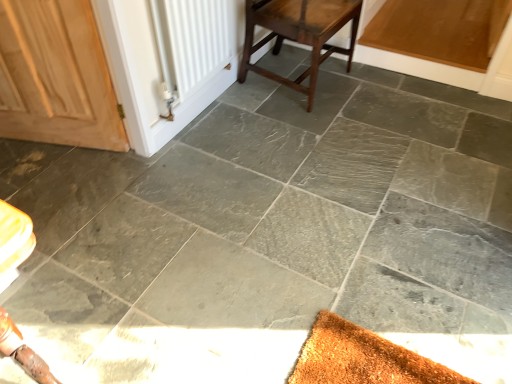
Question: Is white matte radiator at upper left completely or partially outside of dark brown wood stool at center?

Choices:
 (A) no
 (B) yes

Answer: (B)

Question: Does white matte radiator at upper left have a greater width compared to dark brown wood stool at center?

Choices:
 (A) no
 (B) yes

Answer: (A)

Question: Is white matte radiator at upper left smaller than dark brown wood stool at center?

Choices:
 (A) yes
 (B) no

Answer: (A)

Question: From the image's perspective, is white matte radiator at upper left beneath dark brown wood stool at center?

Choices:
 (A) no
 (B) yes

Answer: (B)

Question: Is white matte radiator at upper left to the right of dark brown wood stool at center from the viewer's perspective?

Choices:
 (A) yes
 (B) no

Answer: (B)

Question: Could you tell me if white matte radiator at upper left is facing dark brown wood stool at center?

Choices:
 (A) yes
 (B) no

Answer: (B)

Question: Is wooden door at left positioned before white matte radiator at upper left?

Choices:
 (A) no
 (B) yes

Answer: (B)

Question: Can you confirm if wooden door at left is bigger than white matte radiator at upper left?

Choices:
 (A) yes
 (B) no

Answer: (A)

Question: Does wooden door at left appear on the right side of white matte radiator at upper left?

Choices:
 (A) no
 (B) yes

Answer: (A)

Question: From the image's perspective, would you say wooden door at left is shown under white matte radiator at upper left?

Choices:
 (A) yes
 (B) no

Answer: (A)

Question: From the image's perspective, is wooden door at left over white matte radiator at upper left?

Choices:
 (A) no
 (B) yes

Answer: (A)

Question: Is white matte radiator at upper left a part of wooden door at left?

Choices:
 (A) no
 (B) yes

Answer: (A)

Question: Is dark brown wood stool at center facing towards wooden door at left?

Choices:
 (A) yes
 (B) no

Answer: (B)